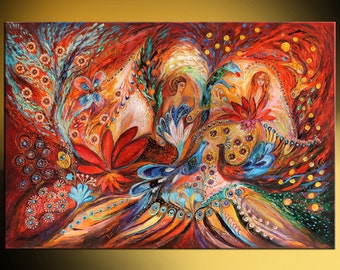
Locate an element on the screen. The image size is (340, 270). elaborate painting is located at coordinates (160, 132).